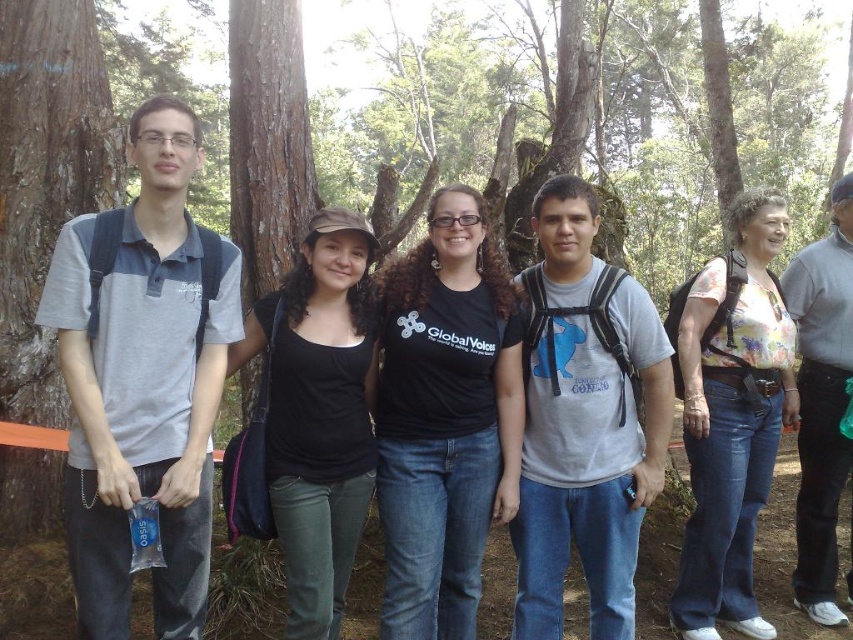
You are standing in the forest and see two points marked in the image. The first point is at coordinate point [331,534] and the second is at point [838,476]. Which point is closer to you?

Point [331,534] is closer to the viewer than point [838,476].

From the picture: Based on the scene description, where is the gray cotton polo shirt at left located in the image?

The gray cotton polo shirt at left is located at the 2D coordinate point of 0.600 in the x axis and 0.169 in the y axis.